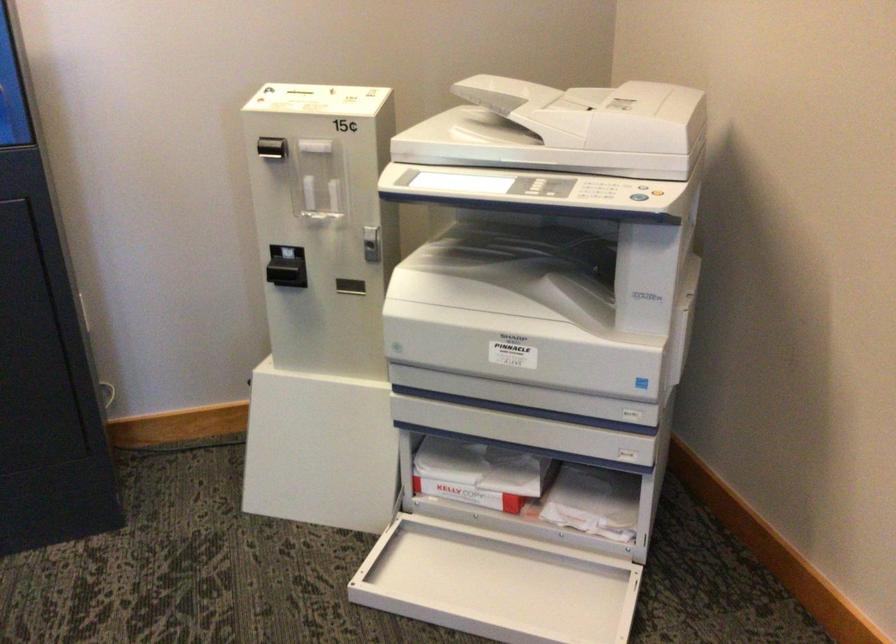
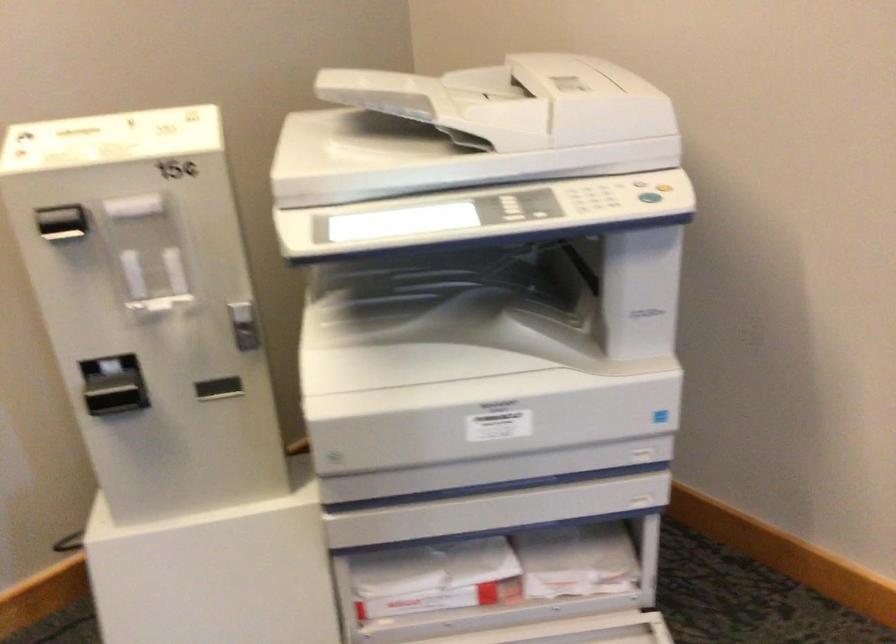
The point at (591, 506) is marked in the first image. Where is the corresponding point in the second image?

(576, 561)